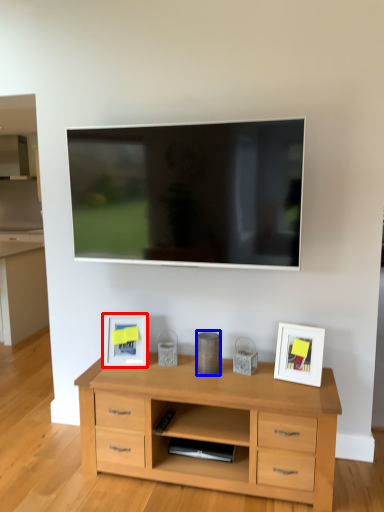
Question: Among these objects, which one is nearest to the camera, picture frame (highlighted by a red box) or appliance (highlighted by a blue box)?

Choices:
 (A) picture frame
 (B) appliance

Answer: (B)